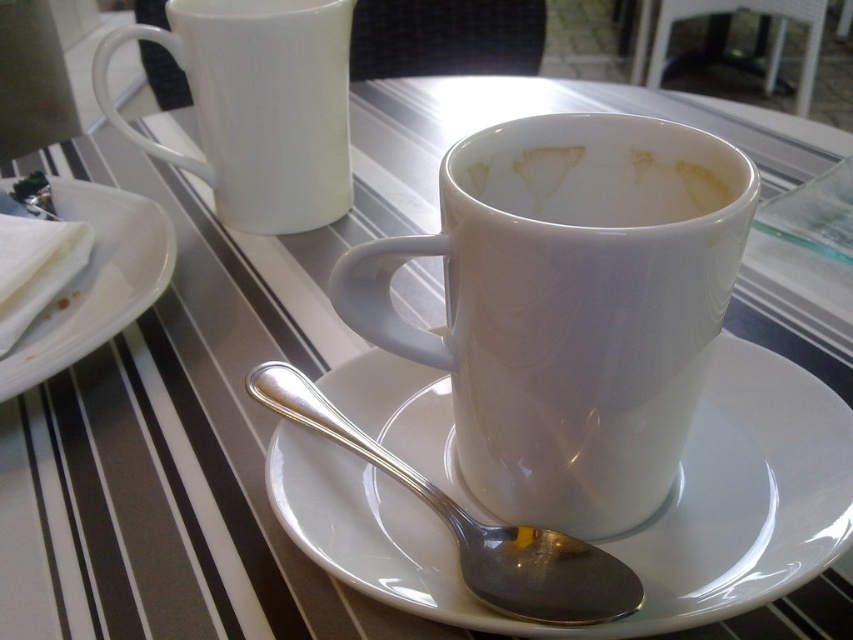
Question: Can you confirm if glossy ceramic mug at center is positioned to the right of white ceramic saucer at center?

Choices:
 (A) no
 (B) yes

Answer: (A)

Question: Does white ceramic saucer at center have a smaller size compared to white glossy mug at upper center?

Choices:
 (A) no
 (B) yes

Answer: (B)

Question: Which point is farther from the camera taking this photo?

Choices:
 (A) (811, 532)
 (B) (573, 164)

Answer: (B)

Question: Which point is farther to the camera?

Choices:
 (A) white paper napkin at left
 (B) white glossy cup at center
 (C) glossy ceramic mug at center

Answer: (A)

Question: Among these points, which one is farthest from the camera?

Choices:
 (A) (727, 164)
 (B) (120, 192)
 (C) (427, 593)

Answer: (B)

Question: Does white ceramic saucer at center appear under white paper napkin at left?

Choices:
 (A) no
 (B) yes

Answer: (B)